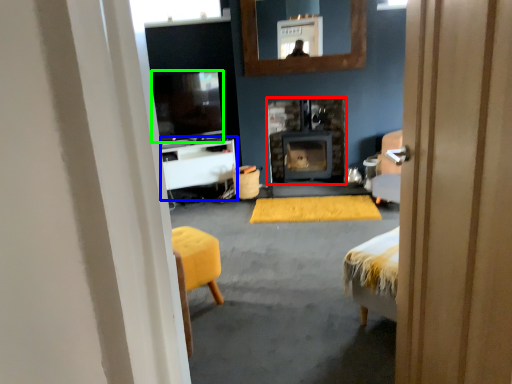
Question: Which is farther away from wood burning stove (highlighted by a red box)? table (highlighted by a blue box) or television (highlighted by a green box)?

Choices:
 (A) table
 (B) television

Answer: (B)